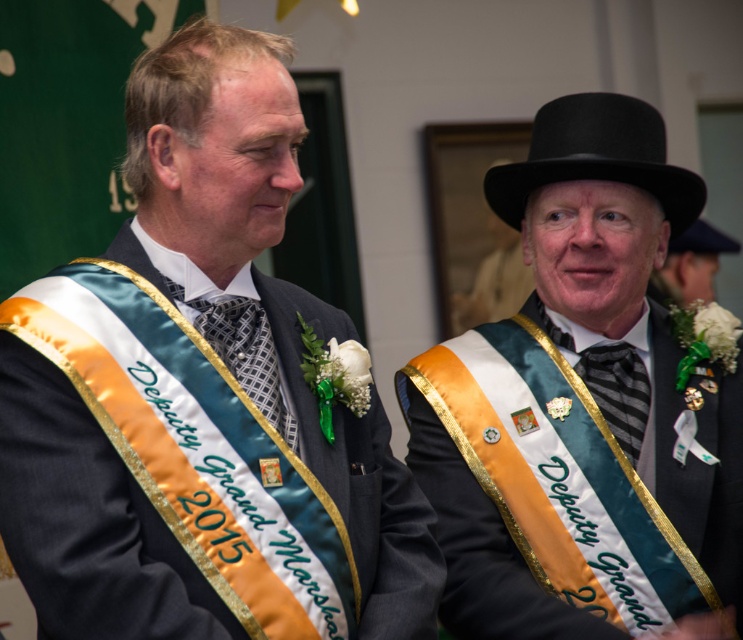
Which of these two, matte black bowler hat at upper right or black felt dress hat at upper right, stands taller?

With more height is matte black bowler hat at upper right.

Does matte black bowler hat at upper right appear over black felt dress hat at upper right?

No, matte black bowler hat at upper right is not above black felt dress hat at upper right.

Which is behind, point (487, 500) or point (539, 172)?

The point (539, 172) is more distant.

At what (x,y) coordinates should I click in order to perform the action: click on matte black bowler hat at upper right. Please return your answer as a coordinate pair (x, y). Looking at the image, I should click on (583, 408).

Which of these two, matte black bowler hat at upper right or patterned silk tie at center, stands taller?

Standing taller between the two is matte black bowler hat at upper right.

Does matte black bowler hat at upper right have a larger size compared to patterned silk tie at center?

Yes, matte black bowler hat at upper right is bigger than patterned silk tie at center.

You are a GUI agent. You are given a task and a screenshot of the screen. Output one action in this format:
    pyautogui.click(x=<x>, y=<y>)
    Task: Click on the matte black bowler hat at upper right
    The width and height of the screenshot is (743, 640).
    Given the screenshot: What is the action you would take?
    pyautogui.click(x=583, y=408)

You are a GUI agent. You are given a task and a screenshot of the screen. Output one action in this format:
    pyautogui.click(x=<x>, y=<y>)
    Task: Click on the matte black bowler hat at upper right
    The image size is (743, 640).
    Given the screenshot: What is the action you would take?
    pyautogui.click(x=583, y=408)

Based on the photo, can you confirm if matte black sash at left is taller than black striped tie at center?

Yes.

Locate an element on the screen. matte black sash at left is located at coordinates (201, 396).